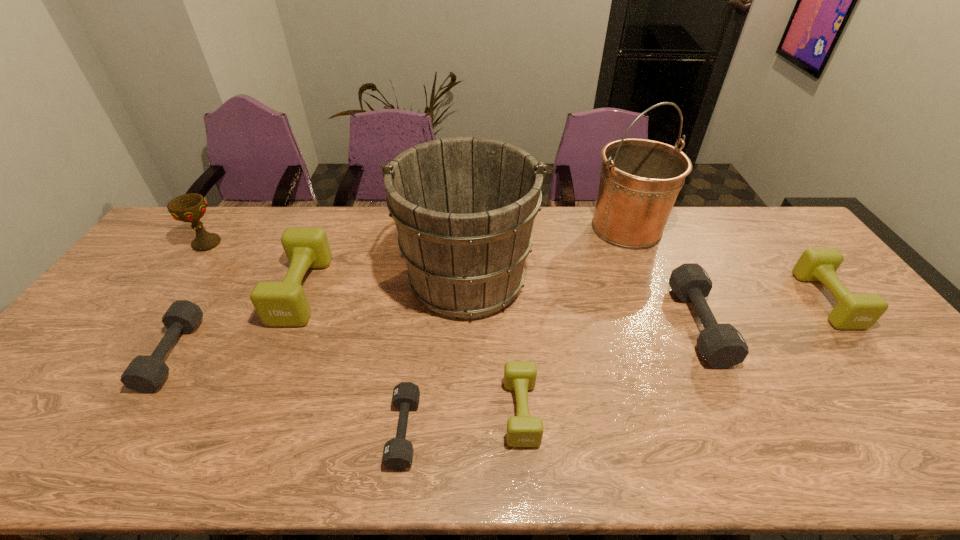
Locate an element on the screen. the right bucket is located at coordinates (640, 180).

At what (x,y) coordinates should I click in order to perform the action: click on the left bucket. Please return your answer as a coordinate pair (x, y). The height and width of the screenshot is (540, 960). Looking at the image, I should click on (464, 208).

Where is `chalice`? This screenshot has width=960, height=540. chalice is located at coordinates (191, 207).

This screenshot has width=960, height=540. I want to click on red chalice, so click(191, 207).

Locate an element on the screen. The image size is (960, 540). the tallest dumbbell is located at coordinates (278, 304).

What are the coordinates of `the third object from left to right` in the screenshot? It's located at (278, 304).

Locate an element on the screen. This screenshot has height=540, width=960. the rightmost olive dumbbell is located at coordinates (853, 311).

At what (x,y) coordinates should I click in order to perform the action: click on the rightmost dumbbell. Please return your answer as a coordinate pair (x, y). This screenshot has width=960, height=540. Looking at the image, I should click on (853, 311).

I want to click on the second dumbbell from right to left, so click(x=721, y=345).

Identify the location of the biggest gray dumbbell. This screenshot has width=960, height=540. (721, 345).